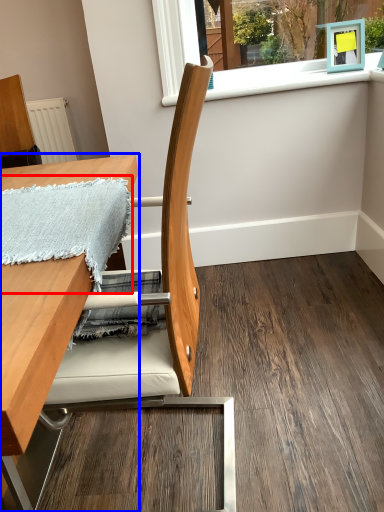
Question: Which point is further to the camera, blanket (highlighted by a red box) or table (highlighted by a blue box)?

Choices:
 (A) blanket
 (B) table

Answer: (A)